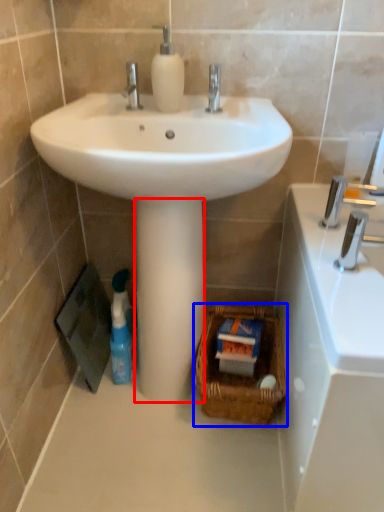
Question: Which object is further to the camera taking this photo, pillar (highlighted by a red box) or basket (highlighted by a blue box)?

Choices:
 (A) pillar
 (B) basket

Answer: (B)